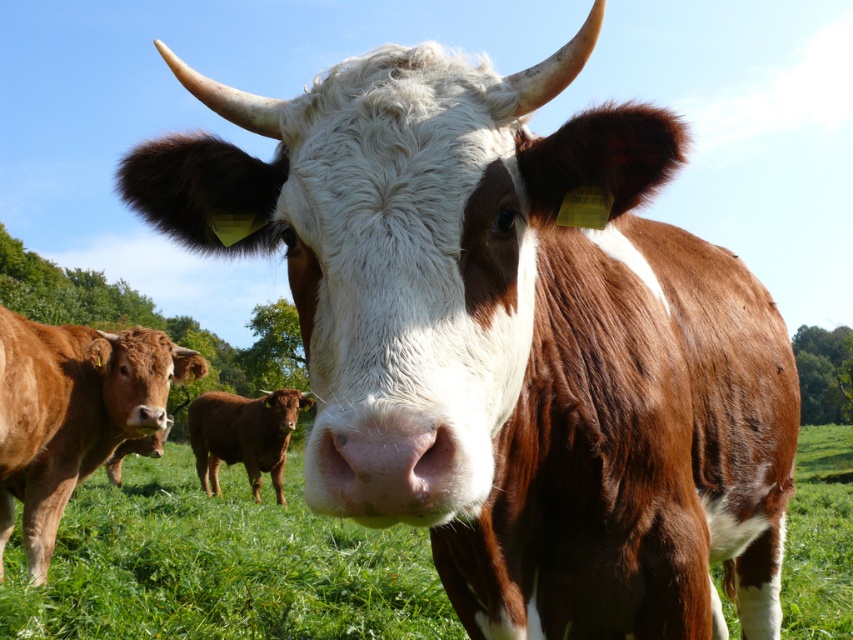
Does brown smooth cow at left lie in front of brown smooth cow at center?

That is True.

The width and height of the screenshot is (853, 640). I want to click on brown smooth cow at left, so click(73, 413).

Locate an element on the screen. The height and width of the screenshot is (640, 853). brown smooth cow at left is located at coordinates (73, 413).

In the scene shown: Is green grassy at center behind brown smooth cow at center?

No, it is not.

Is green grassy at center to the left of brown smooth cow at center from the viewer's perspective?

In fact, green grassy at center is to the right of brown smooth cow at center.

Describe the element at coordinates (219, 564) in the screenshot. I see `green grassy at center` at that location.

Find the location of a particular element. green grassy at center is located at coordinates (219, 564).

Consider the image. Does green grassy at center appear on the right side of brown smooth cow at left?

Indeed, green grassy at center is positioned on the right side of brown smooth cow at left.

Is green grassy at center shorter than brown smooth cow at left?

No, green grassy at center is not shorter than brown smooth cow at left.

Which is in front, point (294, 605) or point (148, 396)?

Point (294, 605) is more forward.

Where is `green grassy at center`? green grassy at center is located at coordinates (219, 564).